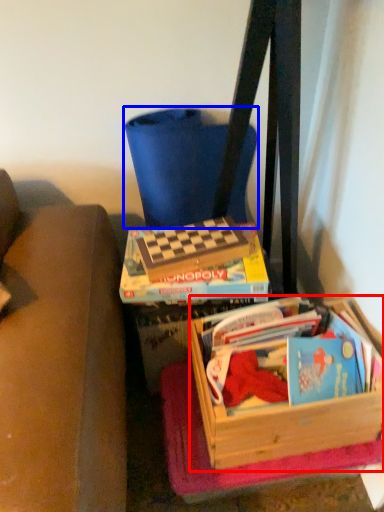
Question: Which object is closer to the camera taking this photo, box (highlighted by a red box) or folding chair (highlighted by a blue box)?

Choices:
 (A) box
 (B) folding chair

Answer: (A)